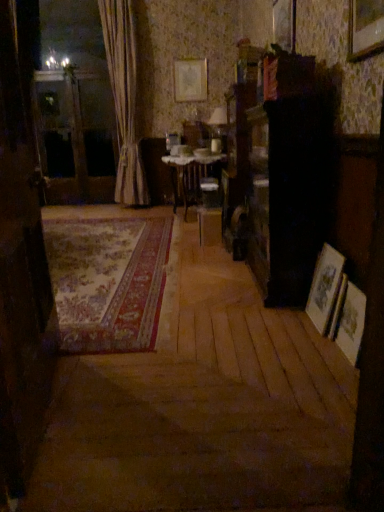
The width and height of the screenshot is (384, 512). I want to click on free region under transparent glass screen door at left, arranged as the 1th screen door when ordered from the bottom (from a real-world perspective), so click(x=58, y=403).